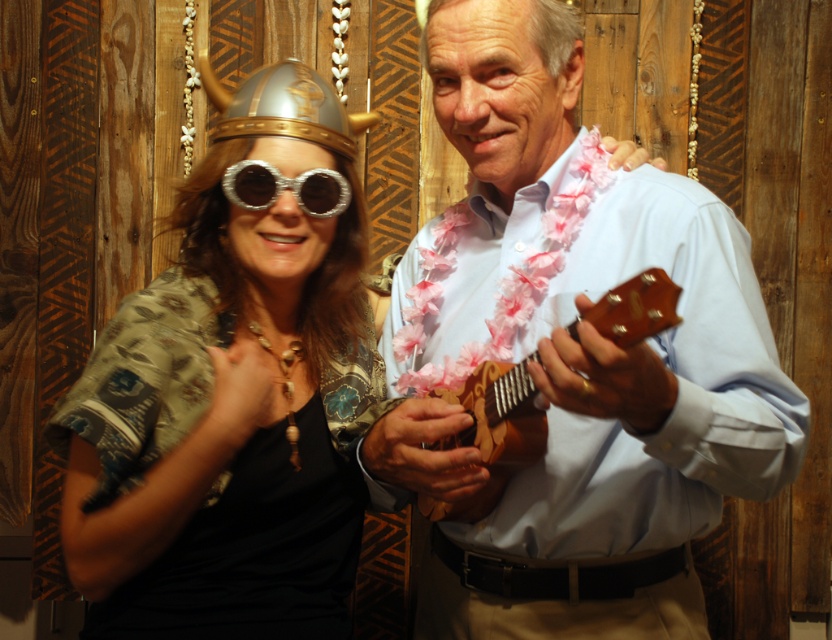
You are trying to determine which object is wider between the wooden ukulele at center and the silver metallic helmet at upper left. Based on the scene, which one is wider?

The silver metallic helmet at upper left is wider than the wooden ukulele at center.

You are a photographer who wants to adjust the focus of your camera to capture both the light blue shirt at center and the silver metallic helmet at upper left clearly. Which object should you focus on first to ensure both are in focus?

You should focus on the light blue shirt at center first since it is closer to the viewer than the silver metallic helmet at upper left, allowing the depth of field to extend backward to include both subjects.

You are a photographer setting up for a group photo. You notice the light blue shirt at center and the silver metallic helmet at upper left in the frame. Which object should you adjust to ensure both are fully visible in the photo?

The light blue shirt at center is taller than the silver metallic helmet at upper left, so you should lower the camera angle or adjust the framing to accommodate the height of the light blue shirt at center while keeping the silver metallic helmet at upper left in view.